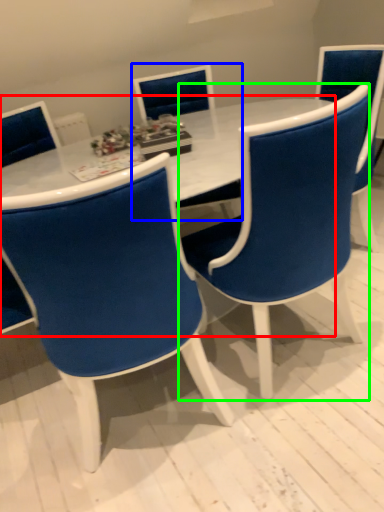
Question: Which object is the closest to the table (highlighted by a red box)? Choose among these: chair (highlighted by a blue box) or chair (highlighted by a green box).

Choices:
 (A) chair
 (B) chair

Answer: (B)